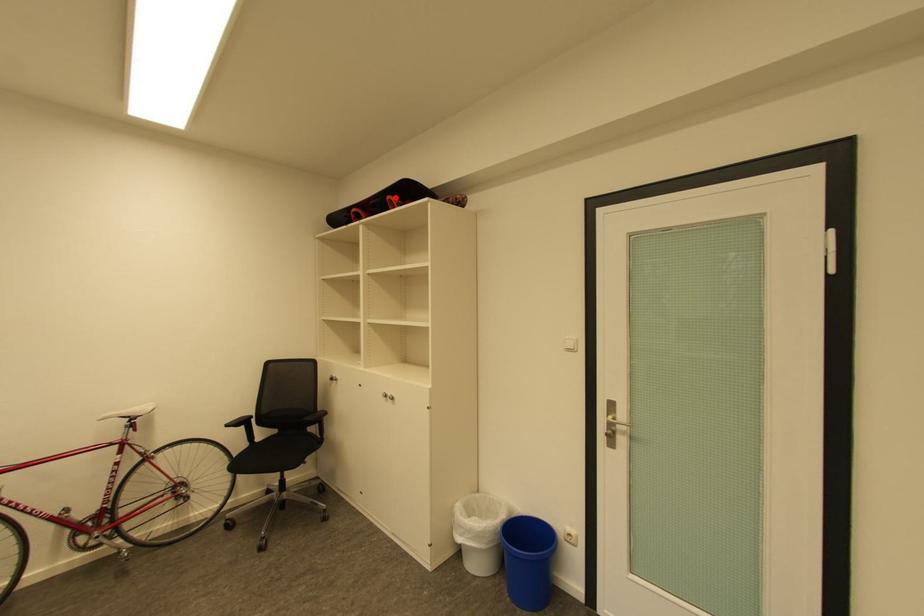
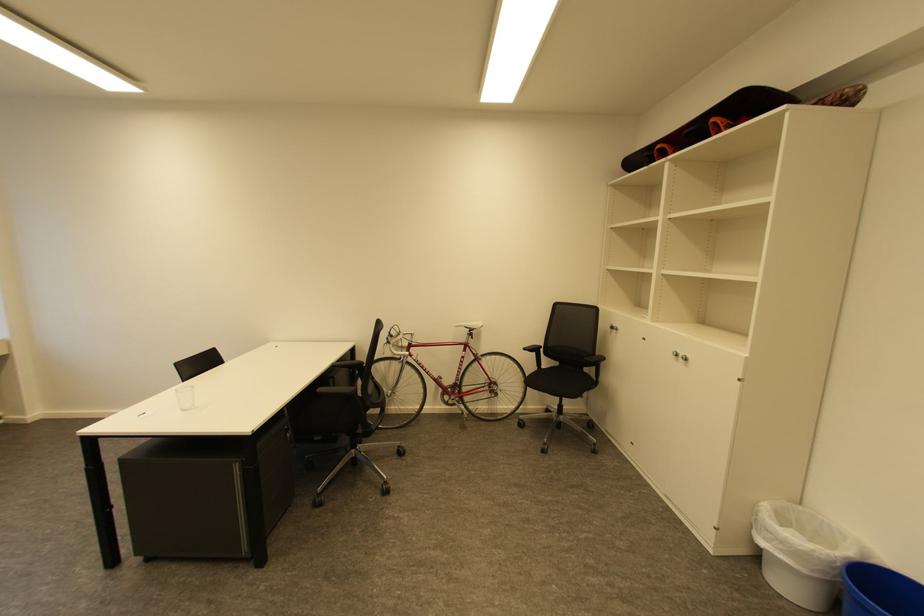
Find the pixel in the second image that matches the highlighted location in the first image.

(719, 120)